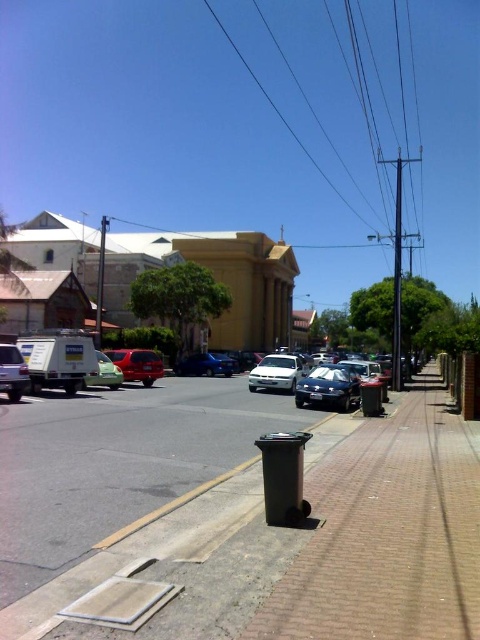
Does metallic blue sedan at center lie in front of green matte car at center-left?

No, metallic blue sedan at center is further to the viewer.

Between metallic blue sedan at center and green matte car at center-left, which one appears on the right side from the viewer's perspective?

metallic blue sedan at center

At what (x,y) coordinates should I click in order to perform the action: click on metallic blue sedan at center. Please return your answer as a coordinate pair (x, y). Image resolution: width=480 pixels, height=640 pixels. Looking at the image, I should click on (205, 364).

Locate an element on the screen. metallic blue sedan at center is located at coordinates (205, 364).

At what (x,y) coordinates should I click in order to perform the action: click on black metallic power line at upper center. Please return your answer as a coordinate pair (x, y). This screenshot has width=480, height=640. Looking at the image, I should click on (280, 113).

Between point (345, 196) and point (121, 376), which one is positioned in front?

Positioned in front is point (121, 376).

Locate an element on the screen. black metallic power line at upper center is located at coordinates (280, 113).

Can you confirm if matte red car at center-left is shorter than white matte van at left?

Yes.

The height and width of the screenshot is (640, 480). Describe the element at coordinates (136, 364) in the screenshot. I see `matte red car at center-left` at that location.

Which is behind, point (162, 365) or point (0, 369)?

Point (162, 365)

At what (x,y) coordinates should I click in order to perform the action: click on matte red car at center-left. Please return your answer as a coordinate pair (x, y). Looking at the image, I should click on (136, 364).